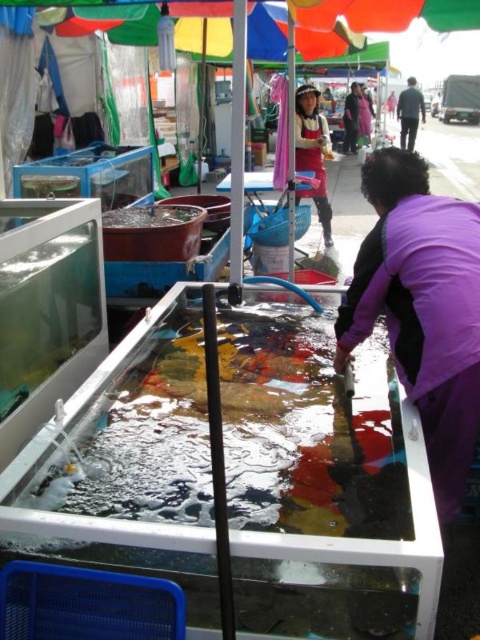
Between purple matte jacket at lower right and dark gray sweater at upper right, which one has more height?

dark gray sweater at upper right

Between purple matte jacket at lower right and dark gray sweater at upper right, which one is positioned higher?

dark gray sweater at upper right is higher up.

Find the location of `purple matte jacket at lower right`. purple matte jacket at lower right is located at coordinates (421, 308).

Which is more to the left, matte purple jacket at center or dark gray sweater at upper right?

From the viewer's perspective, matte purple jacket at center appears more on the left side.

Who is more forward, (314, 200) or (405, 132)?

Positioned in front is point (314, 200).

Is point (310, 128) farther from viewer compared to point (417, 115)?

That is False.

Image resolution: width=480 pixels, height=640 pixels. I want to click on matte purple jacket at center, so click(312, 152).

Can you confirm if purple matte jacket at lower right is shorter than matte purple jacket at center?

Yes, purple matte jacket at lower right is shorter than matte purple jacket at center.

Is purple matte jacket at lower right smaller than matte purple jacket at center?

Yes.

Where is `purple matte jacket at lower right`? purple matte jacket at lower right is located at coordinates (421, 308).

In order to click on purple matte jacket at lower right in this screenshot , I will do `click(421, 308)`.